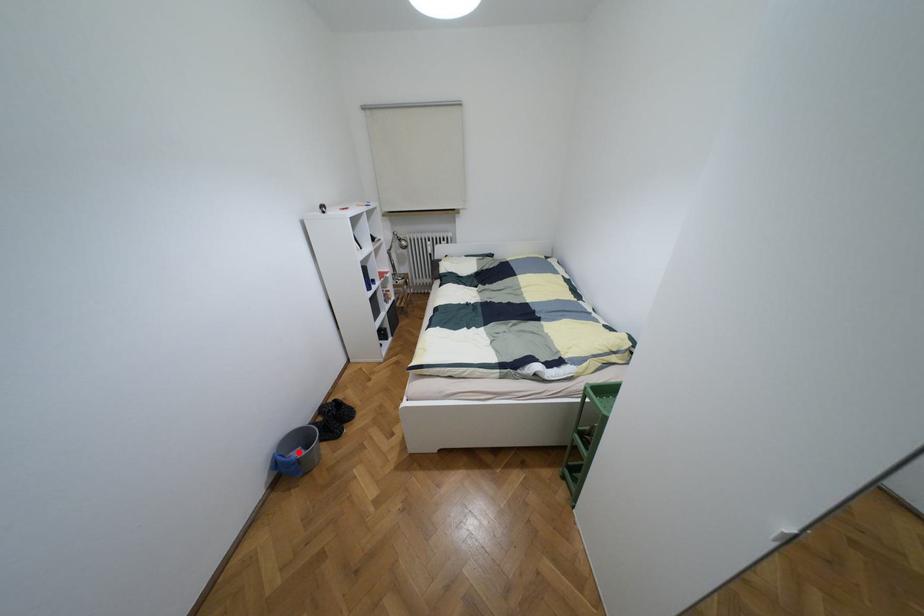
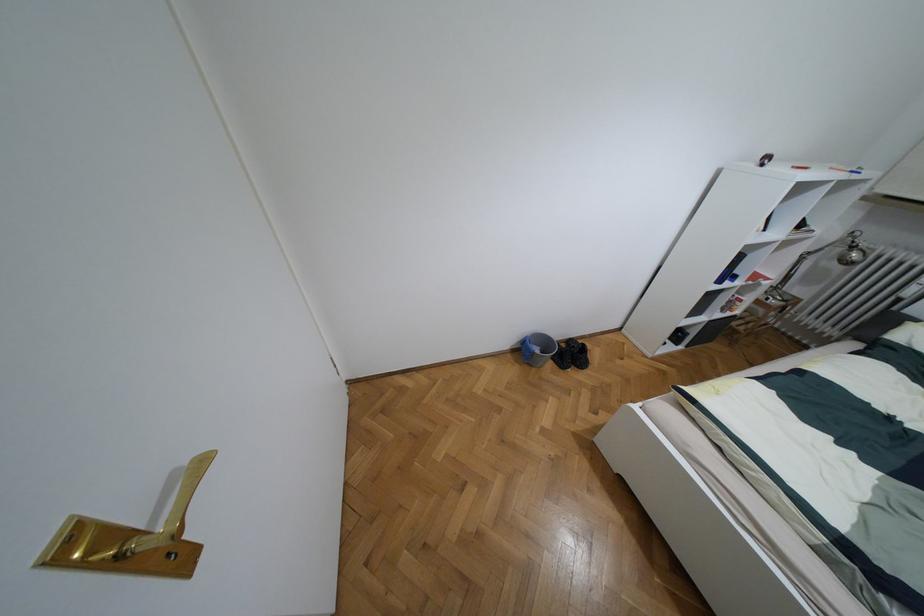
Where in the second image is the point corresponding to the highlighted location from the first image?

(536, 350)